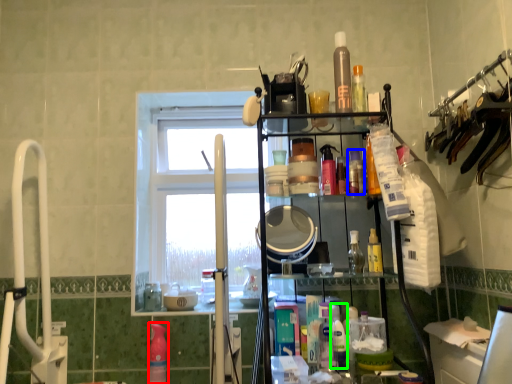
Question: Which is nearer to the cleaning product (highlighted by a red box)? toiletry (highlighted by a blue box) or cleaning product (highlighted by a green box).

Choices:
 (A) toiletry
 (B) cleaning product

Answer: (B)